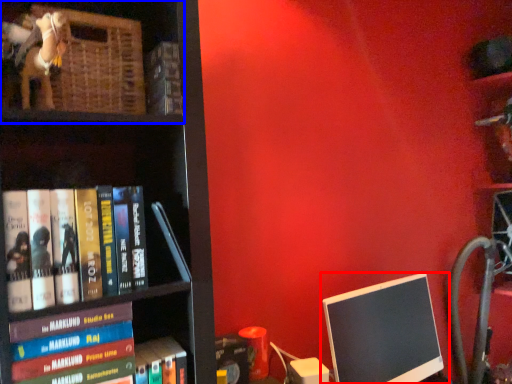
Question: Among these objects, which one is nearest to the camera, computer monitor (highlighted by a red box) or shelf (highlighted by a blue box)?

Choices:
 (A) computer monitor
 (B) shelf

Answer: (B)